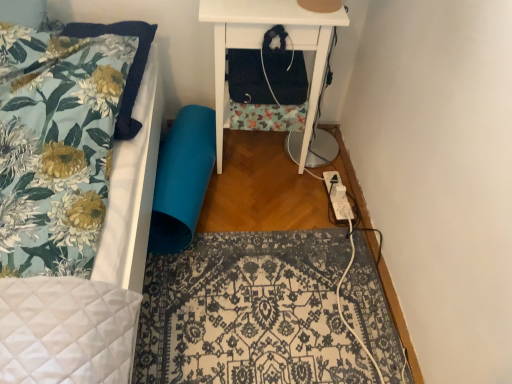
Question: In the image, is patterned fabric rug at center positioned in front of or behind white plastic extension cord at lower right?

Choices:
 (A) behind
 (B) front

Answer: (B)

Question: Is point (140, 326) closer or farther from the camera than point (342, 215)?

Choices:
 (A) farther
 (B) closer

Answer: (B)

Question: Estimate the real-world distances between objects in this image. Which object is closer to the teal fabric swivel chair at lower left?

Choices:
 (A) white plastic extension cord at lower right
 (B) white matte nightstand at upper right
 (C) floral fabric pillow at upper left
 (D) patterned fabric rug at center

Answer: (B)

Question: Estimate the real-world distances between objects in this image. Which object is farther from the floral fabric pillow at upper left?

Choices:
 (A) teal fabric swivel chair at lower left
 (B) patterned fabric rug at center
 (C) white matte nightstand at upper right
 (D) white plastic extension cord at lower right

Answer: (D)